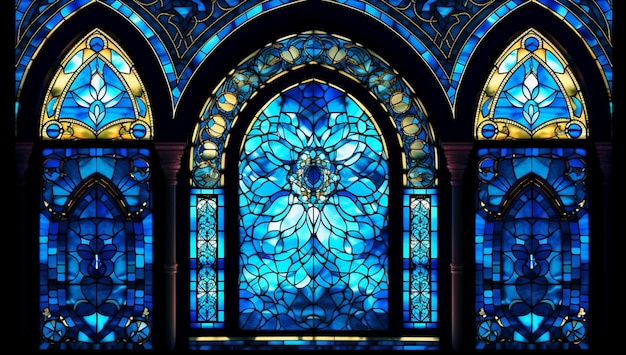
Identify the location of yellow half circle large window. The image size is (626, 355). (427, 144), (210, 146).